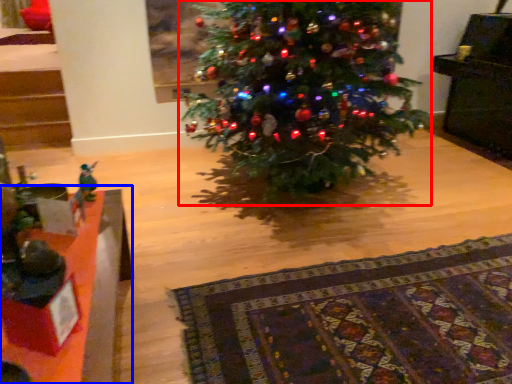
Question: Among these objects, which one is nearest to the camera, christmas tree (highlighted by a red box) or table (highlighted by a blue box)?

Choices:
 (A) christmas tree
 (B) table

Answer: (B)